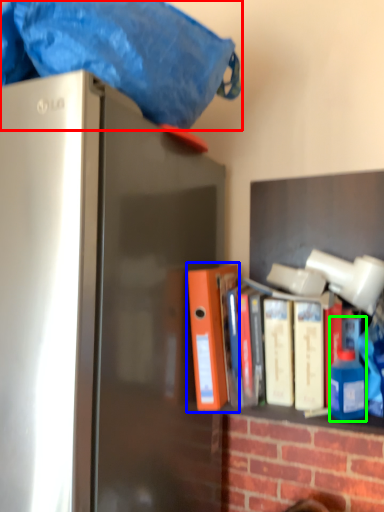
Question: Considering the real-world distances, which object is farthest from blanket (highlighted by a red box)? book (highlighted by a blue box) or bottle (highlighted by a green box)?

Choices:
 (A) book
 (B) bottle

Answer: (B)